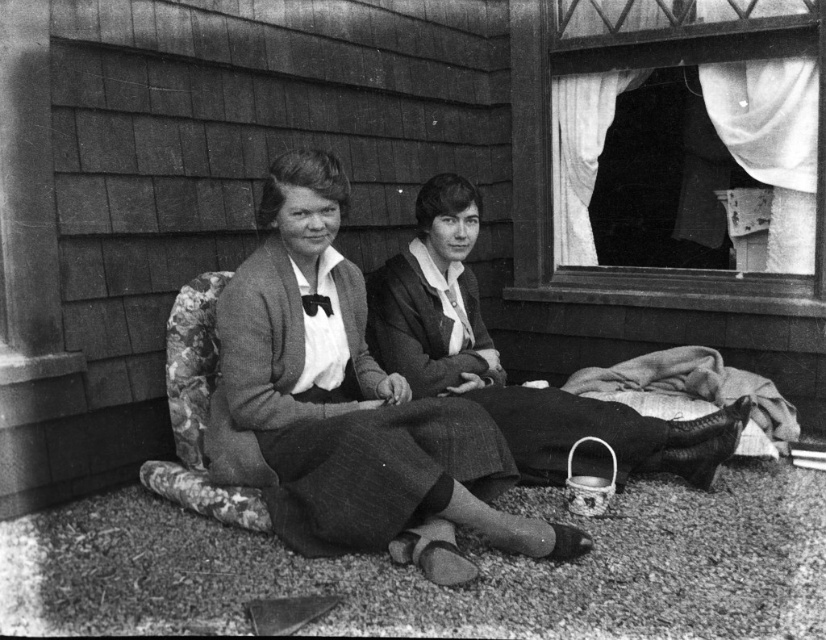
You are a fashion designer observing two dresses displayed on mannequins in the center of a store window. The store window has a matte black dress at center and a smooth fabric dress at center. Which dress takes up more space in the display?

The matte black dress at center is larger in size than the smooth fabric dress at center, so it takes up more space in the display.

You are a photographer adjusting your camera to focus on two points in the image. The first point is point (264, 317) and the second is point (373, 280). Which point should you focus on first if you want to start with the one closer to the camera?

You should focus on point (264, 317) first because it is closer to the camera than point (373, 280).